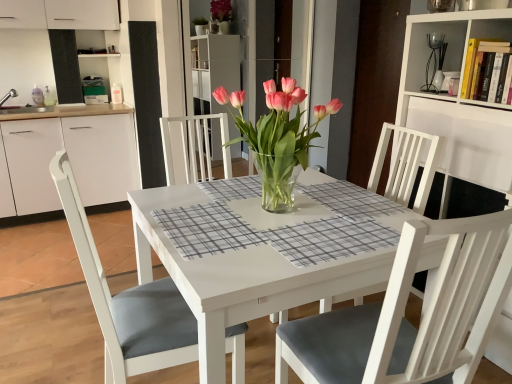
Question: Should I look upward or downward to see white glossy table at center?

Choices:
 (A) up
 (B) down

Answer: (B)

Question: From the image's perspective, is white wood chair at center on hardcover books at upper right?

Choices:
 (A) no
 (B) yes

Answer: (A)

Question: Can you confirm if white wood chair at center is thinner than hardcover books at upper right?

Choices:
 (A) yes
 (B) no

Answer: (B)

Question: Does white wood chair at center come in front of hardcover books at upper right?

Choices:
 (A) yes
 (B) no

Answer: (A)

Question: Does white wood chair at center have a larger size compared to hardcover books at upper right?

Choices:
 (A) yes
 (B) no

Answer: (A)

Question: Does white wood chair at center contain hardcover books at upper right?

Choices:
 (A) no
 (B) yes

Answer: (A)

Question: Is white wood chair at center to the left of hardcover books at upper right from the viewer's perspective?

Choices:
 (A) no
 (B) yes

Answer: (B)

Question: Is white glossy table at center far away from hardcover books at upper right?

Choices:
 (A) yes
 (B) no

Answer: (A)

Question: From the image's perspective, is white glossy table at center above hardcover books at upper right?

Choices:
 (A) yes
 (B) no

Answer: (B)

Question: Is white glossy table at center oriented towards hardcover books at upper right?

Choices:
 (A) no
 (B) yes

Answer: (A)

Question: Is white glossy table at center looking in the opposite direction of hardcover books at upper right?

Choices:
 (A) yes
 (B) no

Answer: (B)

Question: Can you confirm if white glossy table at center is positioned to the left of hardcover books at upper right?

Choices:
 (A) no
 (B) yes

Answer: (B)

Question: Can you confirm if white glossy table at center is bigger than hardcover books at upper right?

Choices:
 (A) no
 (B) yes

Answer: (B)

Question: Could white wood chair at center be considered to be inside white wood bookshelf at upper right?

Choices:
 (A) yes
 (B) no

Answer: (B)